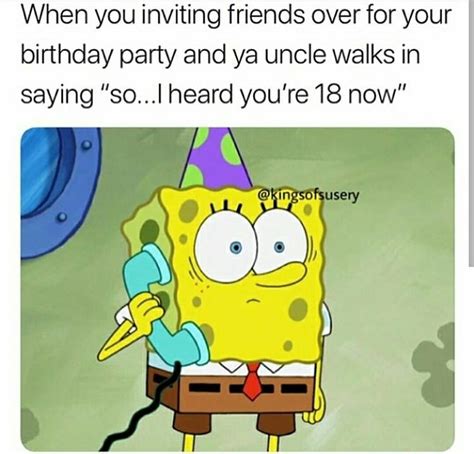
Find the location of a particular element. Image resolution: width=474 pixels, height=454 pixels. black phone cord is located at coordinates (138, 419).